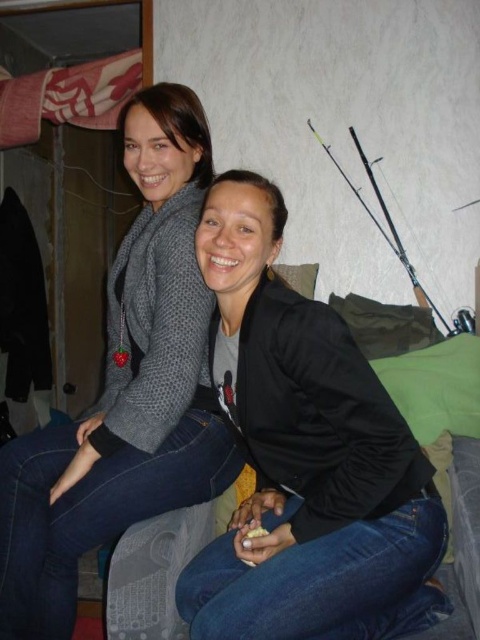
You are standing in front of the black matte jacket at center. You want to reach into your pocket to grab your keys. Will you be able to do this without moving closer to the jacket?

The distance between you and the black matte jacket at center is 38.31 inches. Since you need to be closer to reach into your pocket, you will need to move forward before attempting to grab your keys.

You are organizing a clothing display and need to place the black matte jacket at center and the knitted gray sweater at upper left side by side. Which item requires more horizontal space due to its width?

The black matte jacket at center requires more horizontal space because its width surpasses that of the knitted gray sweater at upper left.

You are a delivery robot that is 10 inches wide. You need to deliver a package between the black matte jacket at center and the knitted gray sweater at upper left. Can you fit through the space between them?

The distance between the black matte jacket at center and the knitted gray sweater at upper left is 9.98 inches. Since the robot is 10 inches wide, it cannot fit through the space between them.